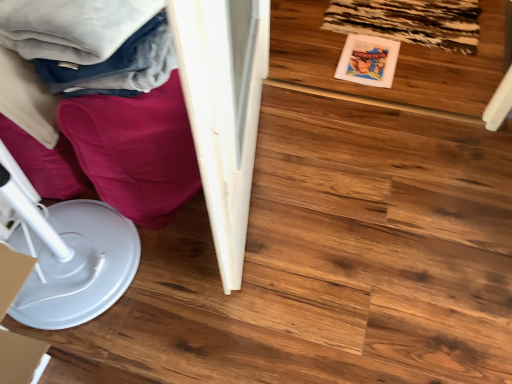
Question: Is wooden floor at center oriented towards soft cotton blanket at upper left?

Choices:
 (A) no
 (B) yes

Answer: (A)

Question: Is wooden floor at center with soft cotton blanket at upper left?

Choices:
 (A) no
 (B) yes

Answer: (A)

Question: From the image's perspective, does wooden floor at center appear lower than soft cotton blanket at upper left?

Choices:
 (A) yes
 (B) no

Answer: (B)

Question: From the image's perspective, is wooden floor at center above soft cotton blanket at upper left?

Choices:
 (A) yes
 (B) no

Answer: (A)

Question: Does wooden floor at center have a greater height compared to soft cotton blanket at upper left?

Choices:
 (A) yes
 (B) no

Answer: (B)

Question: Is wooden floor at center looking in the opposite direction of soft cotton blanket at upper left?

Choices:
 (A) no
 (B) yes

Answer: (A)

Question: Could you tell me if white plastic paper plate at lower left is turned towards soft cotton blanket at upper left?

Choices:
 (A) yes
 (B) no

Answer: (B)

Question: Is white plastic paper plate at lower left positioned with its back to soft cotton blanket at upper left?

Choices:
 (A) yes
 (B) no

Answer: (B)

Question: Are white plastic paper plate at lower left and soft cotton blanket at upper left far apart?

Choices:
 (A) no
 (B) yes

Answer: (A)

Question: Is white plastic paper plate at lower left directly adjacent to soft cotton blanket at upper left?

Choices:
 (A) yes
 (B) no

Answer: (B)

Question: Is white plastic paper plate at lower left to the right of soft cotton blanket at upper left from the viewer's perspective?

Choices:
 (A) no
 (B) yes

Answer: (A)

Question: Considering the relative sizes of white plastic paper plate at lower left and soft cotton blanket at upper left in the image provided, is white plastic paper plate at lower left shorter than soft cotton blanket at upper left?

Choices:
 (A) no
 (B) yes

Answer: (A)

Question: Does white glossy wardrobe at left have a greater height compared to white plastic paper plate at lower left?

Choices:
 (A) no
 (B) yes

Answer: (B)